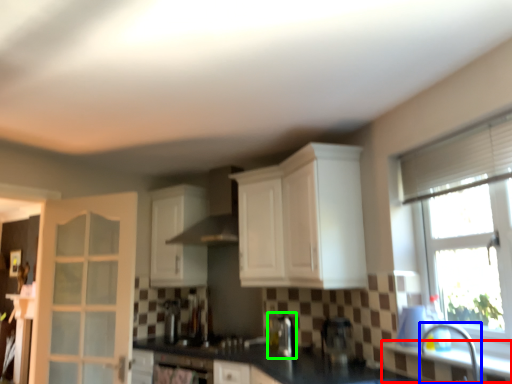
Question: Estimate the real-world distances between objects in this image. Which object is closer to window sill (highlighted by a red box), faucet (highlighted by a blue box) or coffee machine (highlighted by a green box)?

Choices:
 (A) faucet
 (B) coffee machine

Answer: (A)